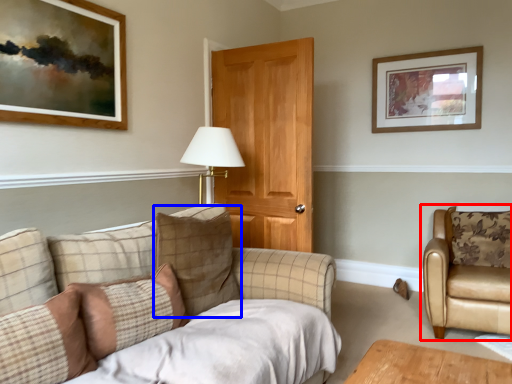
Question: Which of the following is the closest to the observer, chair (highlighted by a red box) or pillow (highlighted by a blue box)?

Choices:
 (A) chair
 (B) pillow

Answer: (B)